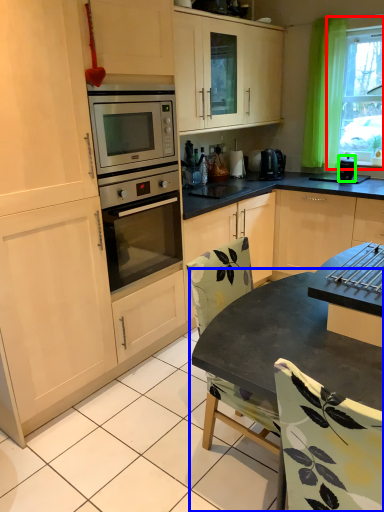
Question: Based on their relative distances, which object is farther from window (highlighted by a red box)? Choose from table (highlighted by a blue box) and appliance (highlighted by a green box).

Choices:
 (A) table
 (B) appliance

Answer: (A)